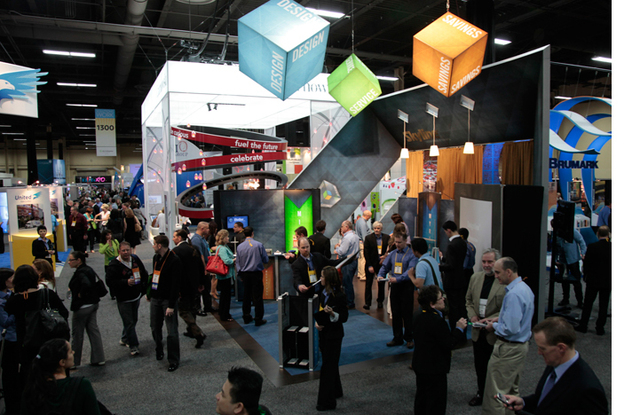
The width and height of the screenshot is (640, 415). Identify the location of ceiling. (150, 30).